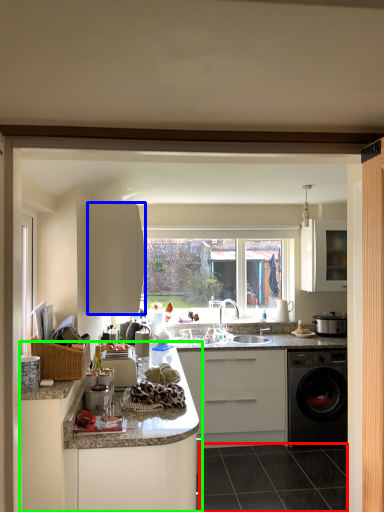
Question: Which object is the farthest from tile (highlighted by a red box)? Choose among these: cabinetry (highlighted by a blue box) or cabinetry (highlighted by a green box).

Choices:
 (A) cabinetry
 (B) cabinetry

Answer: (A)